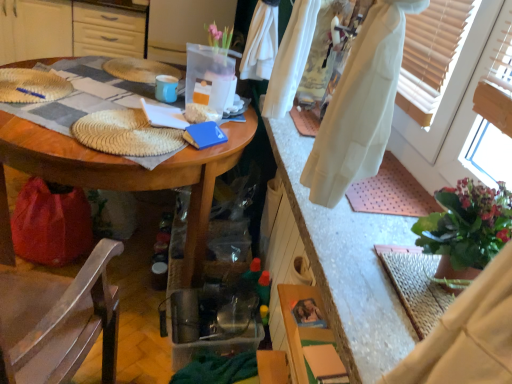
Question: Would you say wooden table at center is outside white cotton robe at lower right?

Choices:
 (A) no
 (B) yes

Answer: (B)

Question: Is wooden table at center looking in the opposite direction of white cotton robe at lower right?

Choices:
 (A) yes
 (B) no

Answer: (B)

Question: From a real-world perspective, does wooden table at center sit lower than white cotton robe at lower right?

Choices:
 (A) yes
 (B) no

Answer: (A)

Question: Is wooden table at center to the left of white cotton robe at lower right from the viewer's perspective?

Choices:
 (A) no
 (B) yes

Answer: (B)

Question: Is wooden table at center next to white cotton robe at lower right?

Choices:
 (A) no
 (B) yes

Answer: (A)

Question: From the image's perspective, relative to white cotton robe at lower right, is wooden table at center above or below?

Choices:
 (A) above
 (B) below

Answer: (A)

Question: From a real-world perspective, relative to white cotton robe at lower right, is wooden table at center vertically above or below?

Choices:
 (A) below
 (B) above

Answer: (A)

Question: From their relative heights in the image, would you say wooden table at center is taller or shorter than white cotton robe at lower right?

Choices:
 (A) short
 (B) tall

Answer: (B)

Question: Would you say wooden table at center is to the left or to the right of white cotton robe at lower right in the picture?

Choices:
 (A) right
 (B) left

Answer: (B)

Question: Relative to wooden table at upper left, is white cotton robe at lower right in front or behind?

Choices:
 (A) behind
 (B) front

Answer: (B)

Question: Does point (416, 360) appear closer or farther from the camera than point (22, 16)?

Choices:
 (A) farther
 (B) closer

Answer: (B)

Question: Would you say white cotton robe at lower right is to the left or to the right of wooden table at upper left in the picture?

Choices:
 (A) left
 (B) right

Answer: (B)

Question: In terms of size, does white cotton robe at lower right appear bigger or smaller than wooden table at upper left?

Choices:
 (A) small
 (B) big

Answer: (A)

Question: From a real-world perspective, relative to wooden chair at lower left, is wooden table at upper left vertically above or below?

Choices:
 (A) above
 (B) below

Answer: (A)

Question: Is wooden table at upper left to the left or to the right of wooden chair at lower left in the image?

Choices:
 (A) left
 (B) right

Answer: (A)